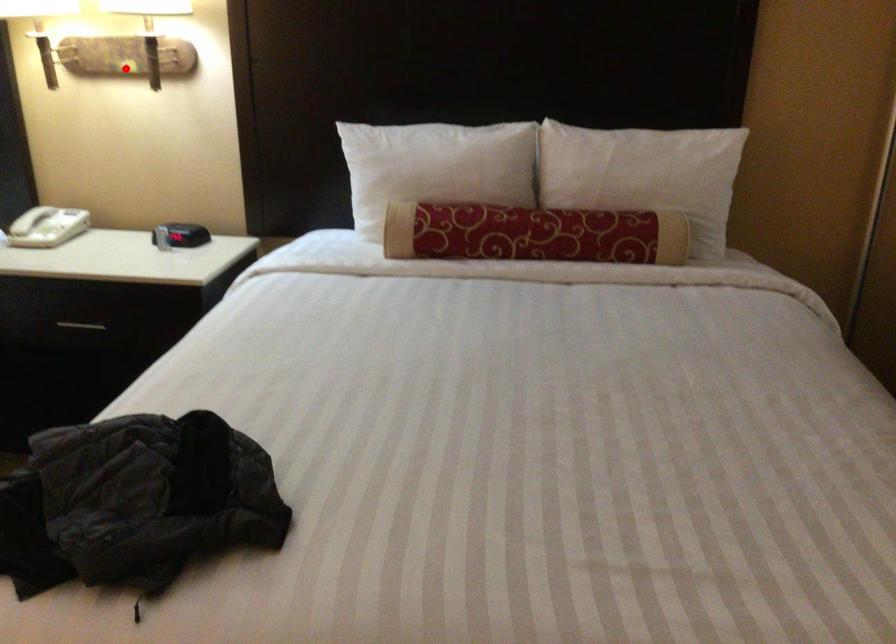
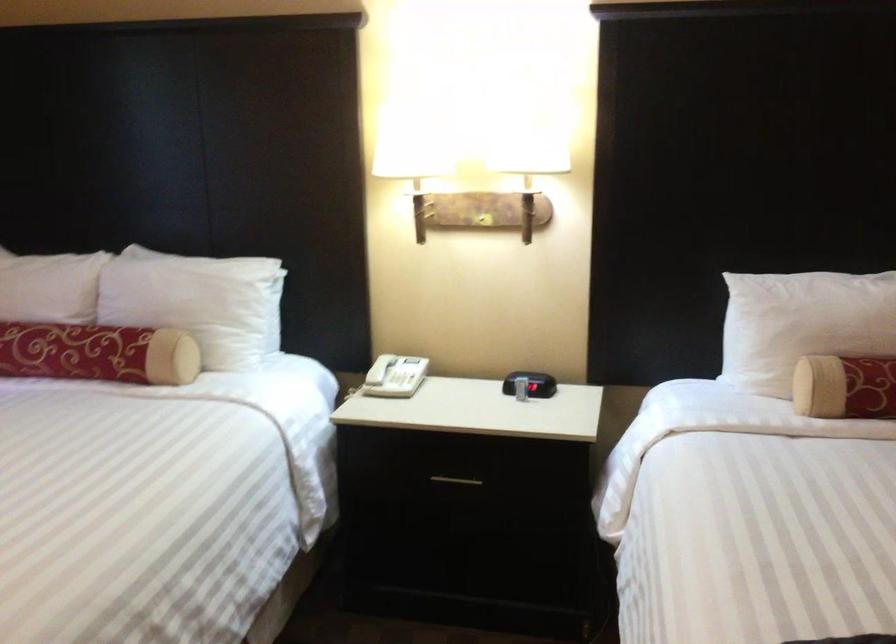
In the second image, find the point that corresponds to the highlighted location in the first image.

(483, 220)